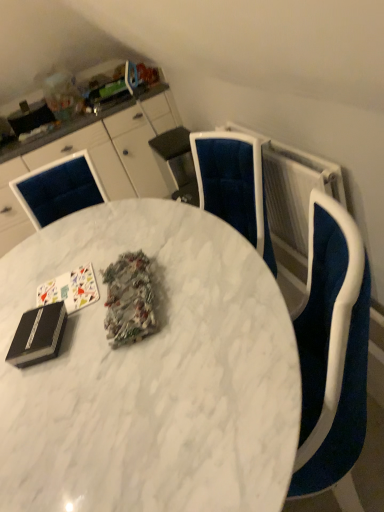
The width and height of the screenshot is (384, 512). I want to click on free point to the right of white matte card game at upper left, so click(x=108, y=262).